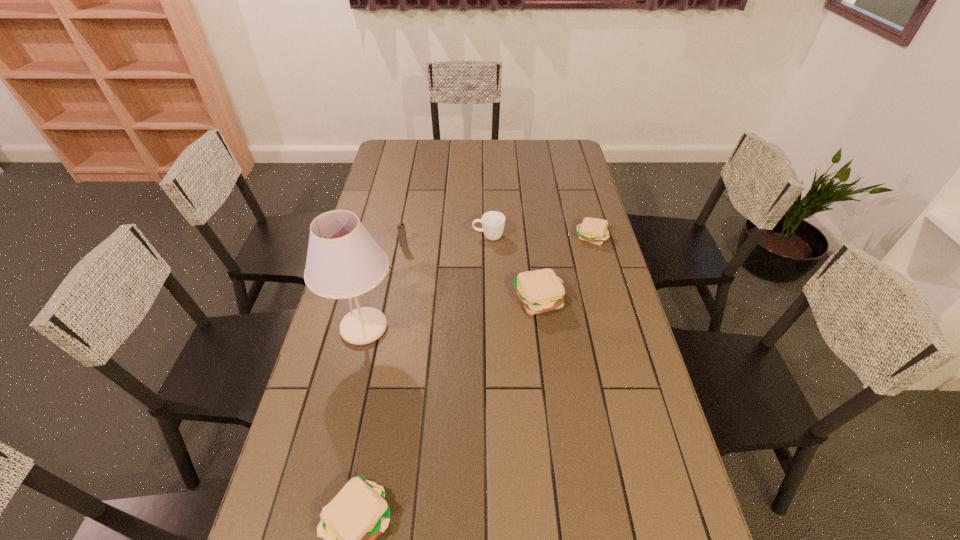
Image resolution: width=960 pixels, height=540 pixels. I want to click on spot to insert another patty_(food) for uniform distribution, so click(466, 389).